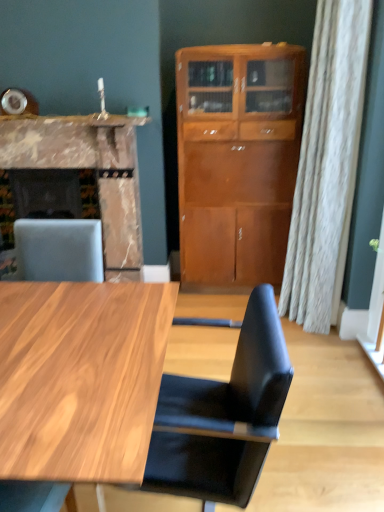
What do you see at coordinates (81, 119) in the screenshot? This screenshot has height=512, width=384. I see `marble countertop at upper left` at bounding box center [81, 119].

This screenshot has height=512, width=384. Identify the location of marble fireplace at left. (86, 168).

Is the position of marble fireplace at left less distant than that of light brown wood cabinet at center?

No, it is behind light brown wood cabinet at center.

How distant is marble fireplace at left from light brown wood cabinet at center?

marble fireplace at left and light brown wood cabinet at center are 27.34 inches apart.

At what (x,y) coordinates should I click in order to perform the action: click on cabinetry that is in front of the marble fireplace at left. Please return your answer as a coordinate pair (x, y). The image size is (384, 512). Looking at the image, I should click on (237, 159).

Is point (66, 139) positioned after point (285, 175)?

No, it is in front of (285, 175).

Can you confirm if black leather chair at center is positioned to the left of marble fireplace at left?

No, black leather chair at center is not to the left of marble fireplace at left.

In the scene shown: How far apart are black leather chair at center and marble fireplace at left?

black leather chair at center and marble fireplace at left are 6.31 feet apart.

Where is `fireplace that appears on the left of black leather chair at center`? fireplace that appears on the left of black leather chair at center is located at coordinates (86, 168).

Is point (236, 374) closer to viewer compared to point (67, 201)?

Yes, point (236, 374) is closer to viewer.

Considering the relative sizes of marble countertop at upper left and black leather chair at center in the image provided, is marble countertop at upper left taller than black leather chair at center?

In fact, marble countertop at upper left may be shorter than black leather chair at center.

Are marble countertop at upper left and black leather chair at center far apart?

Yes, marble countertop at upper left is far from black leather chair at center.

In the image, is marble countertop at upper left on the left side or the right side of black leather chair at center?

marble countertop at upper left is positioned on black leather chair at center's left side.

Could you tell me if marble countertop at upper left is facing black leather chair at center?

No, marble countertop at upper left does not turn towards black leather chair at center.

Does point (14, 116) appear closer or farther from the camera than point (88, 144)?

Point (14, 116) is positioned closer to the camera compared to point (88, 144).

Can we say marble countertop at upper left lies outside marble fireplace at left?

Indeed, marble countertop at upper left is completely outside marble fireplace at left.

Considering the relative sizes of marble countertop at upper left and marble fireplace at left in the image provided, is marble countertop at upper left thinner than marble fireplace at left?

Indeed, marble countertop at upper left has a lesser width compared to marble fireplace at left.

From a real-world perspective, which object rests below the other?

marble fireplace at left.

Is light brown wood cabinet at center positioned behind marble countertop at upper left?

No, the depth of light brown wood cabinet at center is less than that of marble countertop at upper left.

From a real-world perspective, which object rests below the other?

light brown wood cabinet at center is physically lower.

Based on the photo, who is shorter, light brown wood cabinet at center or marble countertop at upper left?

Standing shorter between the two is marble countertop at upper left.

Can you confirm if light brown wood cabinet at center is wider than marble countertop at upper left?

Yes, light brown wood cabinet at center is wider than marble countertop at upper left.

Who is taller, black leather chair at center or light brown wood cabinet at center?

Standing taller between the two is light brown wood cabinet at center.

Considering the sizes of objects black leather chair at center and light brown wood cabinet at center in the image provided, who is bigger, black leather chair at center or light brown wood cabinet at center?

Bigger between the two is light brown wood cabinet at center.

Locate an element on the screen. This screenshot has width=384, height=512. cabinetry that is behind the black leather chair at center is located at coordinates 237,159.

Which object is thinner, black leather chair at center or light brown wood cabinet at center?

light brown wood cabinet at center is thinner.

Is light brown wood cabinet at center facing away from marble fireplace at left?

No, marble fireplace at left is not at the back of light brown wood cabinet at center.

Considering the positions of points (178, 98) and (15, 162), is point (178, 98) farther from camera compared to point (15, 162)?

No, it is not.

This screenshot has height=512, width=384. I want to click on fireplace behind the light brown wood cabinet at center, so click(86, 168).

Where is `fireplace on the left of the light brown wood cabinet at center`? This screenshot has height=512, width=384. fireplace on the left of the light brown wood cabinet at center is located at coordinates (86, 168).

At what (x,y) coordinates should I click in order to perform the action: click on chair below the marble fireplace at left (from a real-world perspective). Please return your answer as a coordinate pair (x, y). Looking at the image, I should click on (223, 416).

Looking at the image, which one is located closer to light brown wood cabinet at center, marble countertop at upper left or black leather chair at center?

marble countertop at upper left is positioned closer to the anchor light brown wood cabinet at center.

Based on their spatial positions, is marble countertop at upper left or marble fireplace at left further from black leather chair at center?

marble countertop at upper left.

Based on their spatial positions, is marble fireplace at left or black leather chair at center further from marble countertop at upper left?

black leather chair at center is further to marble countertop at upper left.

Based on their spatial positions, is marble countertop at upper left or light brown wood cabinet at center closer to black leather chair at center?

The object closer to black leather chair at center is light brown wood cabinet at center.

Based on their spatial positions, is marble countertop at upper left or black leather chair at center closer to marble fireplace at left?

marble countertop at upper left is closer to marble fireplace at left.

When comparing their distances from marble fireplace at left, does black leather chair at center or marble countertop at upper left seem further?

black leather chair at center is further to marble fireplace at left.

Looking at this image, looking at the image, which one is located closer to light brown wood cabinet at center, marble countertop at upper left or marble fireplace at left?

marble fireplace at left.

When comparing their distances from light brown wood cabinet at center, does marble fireplace at left or marble countertop at upper left seem further?

marble countertop at upper left.

I want to click on counter top positioned between black leather chair at center and marble fireplace at left from near to far, so click(81, 119).

This screenshot has height=512, width=384. In order to click on cabinetry between black leather chair at center and marble fireplace at left in the front-back direction in this screenshot , I will do `click(237, 159)`.

At what (x,y) coordinates should I click in order to perform the action: click on cabinetry positioned between black leather chair at center and marble countertop at upper left from near to far. Please return your answer as a coordinate pair (x, y). Looking at the image, I should click on (237, 159).

Where is `counter top between marble fireplace at left and light brown wood cabinet at center in the horizontal direction`? Image resolution: width=384 pixels, height=512 pixels. counter top between marble fireplace at left and light brown wood cabinet at center in the horizontal direction is located at coordinates (81, 119).